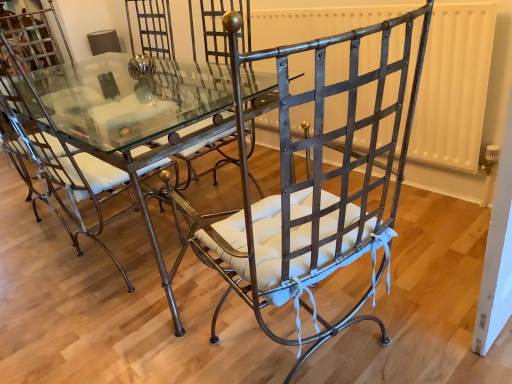
Question: Which direction should I rotate to look at metallic wrought iron chair at center, positioned as the first chair in right-to-left order?

Choices:
 (A) right
 (B) left

Answer: (A)

Question: Could metallic wrought iron chair at center, which is the second chair in left-to-right order, be considered to be inside clear glass table at center?

Choices:
 (A) no
 (B) yes

Answer: (A)

Question: Is clear glass table at center positioned behind metallic wrought iron chair at center, which is the second chair in left-to-right order?

Choices:
 (A) yes
 (B) no

Answer: (A)

Question: From a real-world perspective, is clear glass table at center on metallic wrought iron chair at center, which is the second chair in left-to-right order?

Choices:
 (A) yes
 (B) no

Answer: (B)

Question: Does clear glass table at center have a smaller size compared to metallic wrought iron chair at center, positioned as the first chair in right-to-left order?

Choices:
 (A) no
 (B) yes

Answer: (A)

Question: Considering the relative sizes of clear glass table at center and metallic wrought iron chair at center, which is the second chair in left-to-right order, in the image provided, is clear glass table at center wider than metallic wrought iron chair at center, which is the second chair in left-to-right order,?

Choices:
 (A) yes
 (B) no

Answer: (A)

Question: Can you confirm if clear glass table at center is positioned to the right of metallic wrought iron chair at center, which is the second chair in left-to-right order?

Choices:
 (A) yes
 (B) no

Answer: (B)

Question: Can you see metallic wrought iron chair at center, positioned as the first chair in right-to-left order, touching clear glass table at center?

Choices:
 (A) no
 (B) yes

Answer: (A)

Question: Does metallic wrought iron chair at center, positioned as the first chair in right-to-left order, have a smaller size compared to clear glass table at center?

Choices:
 (A) no
 (B) yes

Answer: (B)

Question: From the image's perspective, is metallic wrought iron chair at center, which is the second chair in left-to-right order, over clear glass table at center?

Choices:
 (A) yes
 (B) no

Answer: (B)

Question: Considering the relative sizes of metallic wrought iron chair at center, positioned as the first chair in right-to-left order, and clear glass table at center in the image provided, is metallic wrought iron chair at center, positioned as the first chair in right-to-left order, wider than clear glass table at center?

Choices:
 (A) no
 (B) yes

Answer: (A)

Question: Is metallic wrought iron chair at center, positioned as the first chair in right-to-left order, not close to clear glass table at center?

Choices:
 (A) yes
 (B) no

Answer: (B)

Question: Considering the relative sizes of metallic wrought iron chair at center, positioned as the first chair in right-to-left order, and clear glass table at center in the image provided, is metallic wrought iron chair at center, positioned as the first chair in right-to-left order, taller than clear glass table at center?

Choices:
 (A) no
 (B) yes

Answer: (B)

Question: Is metallic wrought iron chair at center, which is the second chair in left-to-right order, at the back of wrought iron chair at center, which ranks as the 2th chair in right-to-left order?

Choices:
 (A) no
 (B) yes

Answer: (A)